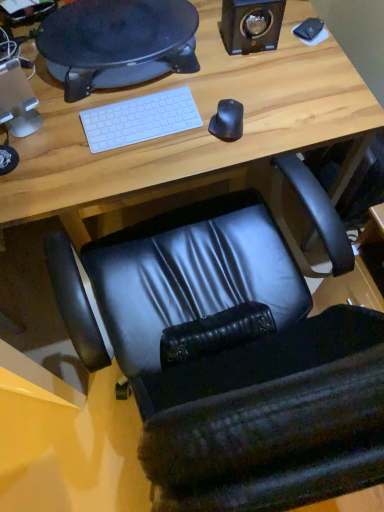
The height and width of the screenshot is (512, 384). In order to click on free point above white matte keyboard at center (from a real-world perspective) in this screenshot , I will do `click(139, 115)`.